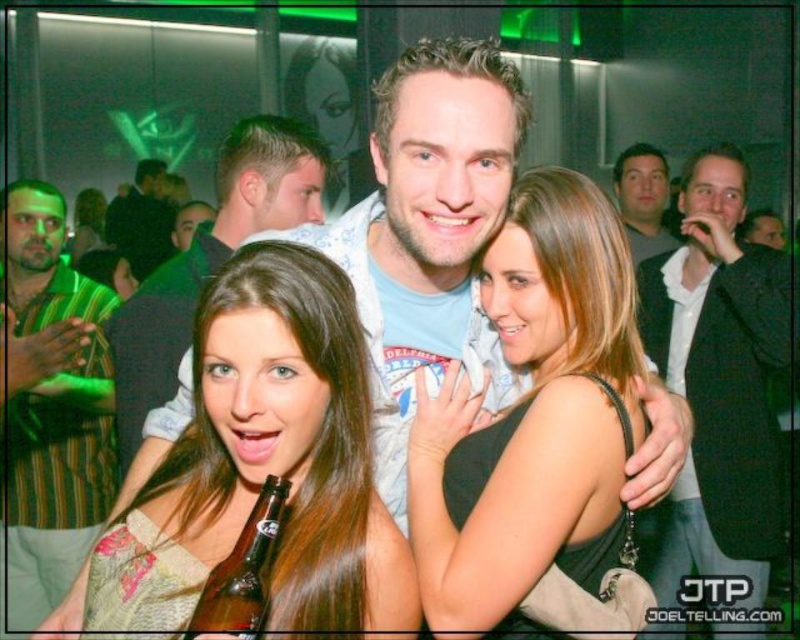
Is brown glass bottle at center positioned before black leather jacket at upper center?

That is True.

Does brown glass bottle at center have a lesser width compared to black leather jacket at upper center?

Yes, brown glass bottle at center is thinner than black leather jacket at upper center.

Is point (282, 477) closer to viewer compared to point (110, 243)?

Yes, point (282, 477) is in front of point (110, 243).

I want to click on brown glass bottle at center, so click(242, 572).

Does smooth brown hair at center have a lesser width compared to black textured suit at right?

Incorrect, smooth brown hair at center's width is not less than black textured suit at right's.

Is point (312, 365) positioned in front of point (786, 348)?

Yes, it is.

Image resolution: width=800 pixels, height=640 pixels. What are the coordinates of `smooth brown hair at center` in the screenshot? It's located at (288, 444).

Can you confirm if black satin dress at center is smaller than striped shirt at left?

Yes, black satin dress at center is smaller than striped shirt at left.

Is black satin dress at center below striped shirt at left?

No.

This screenshot has width=800, height=640. What do you see at coordinates (532, 417) in the screenshot?
I see `black satin dress at center` at bounding box center [532, 417].

Find the location of `black satin dress at center`. black satin dress at center is located at coordinates (532, 417).